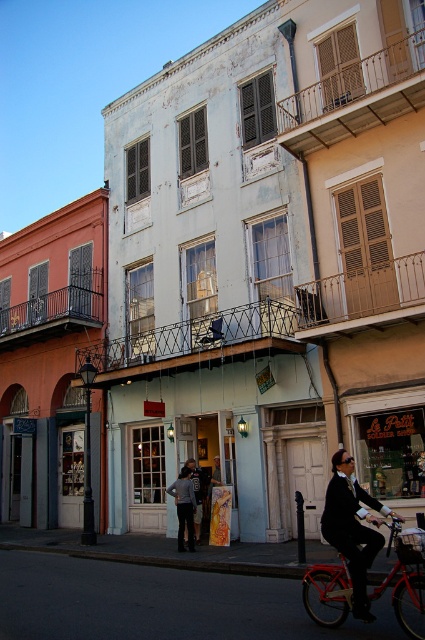
You are a tailor observing the street scene. You need to determine which clothing item, the matte black suit at lower right or the dark gray fabric jacket at center, requires more fabric to make. Based on the scene, which one would you choose?

The matte black suit at lower right requires more fabric to make because its width is larger than the dark gray fabric jacket at center.

You are a delivery person needing to pass through the narrow alley between the central light blue building and the beige building on the right. You have a metallic red bicycle at center and a dark gray fabric jacket at center with you. Considering their sizes, which item should you carry first to ensure you can navigate the tight space?

The metallic red bicycle at center is not as tall as the dark gray fabric jacket at center, so you should carry the taller dark gray fabric jacket at center first to ensure it fits through the narrow alley.